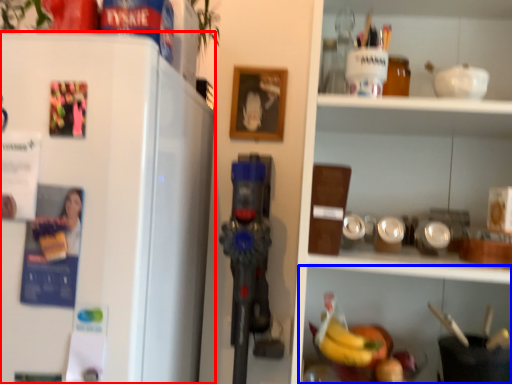
Question: Which object appears closest to the camera in this image, refrigerator (highlighted by a red box) or shelf (highlighted by a blue box)?

Choices:
 (A) refrigerator
 (B) shelf

Answer: (A)